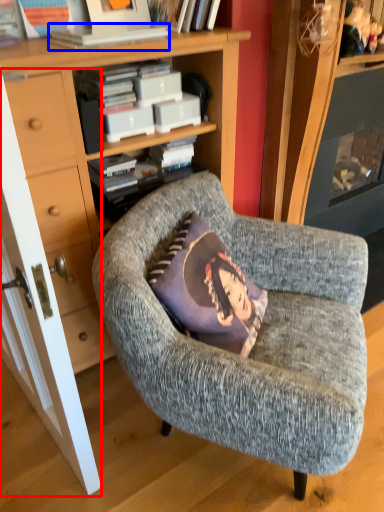
Question: Which object appears closest to the camera in this image, door (highlighted by a red box) or book (highlighted by a blue box)?

Choices:
 (A) door
 (B) book

Answer: (A)